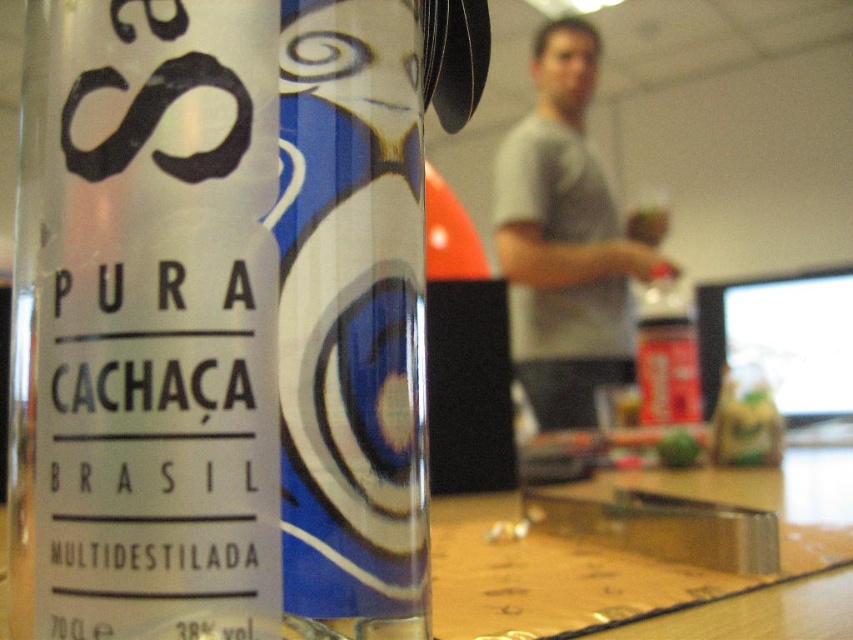
Question: Does clear glass bottle at center lie behind gray cotton shirt at upper center?

Choices:
 (A) no
 (B) yes

Answer: (A)

Question: Does clear glass bottle at center appear over gray cotton shirt at upper center?

Choices:
 (A) no
 (B) yes

Answer: (A)

Question: Does clear glass bottle at center have a greater width compared to gray cotton shirt at upper center?

Choices:
 (A) no
 (B) yes

Answer: (A)

Question: Which object is closer to the camera taking this photo?

Choices:
 (A) clear glass bottle at center
 (B) gray cotton shirt at upper center

Answer: (A)